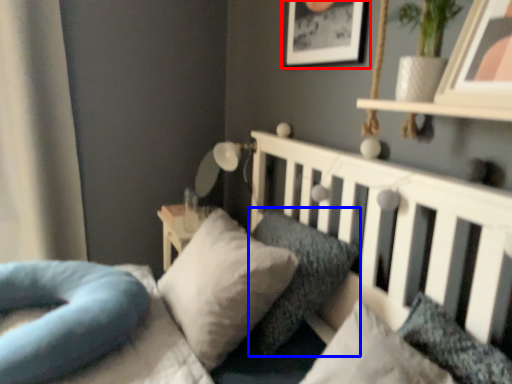
Question: Which object appears closest to the camera in this image, picture frame (highlighted by a red box) or pillow (highlighted by a blue box)?

Choices:
 (A) picture frame
 (B) pillow

Answer: (B)